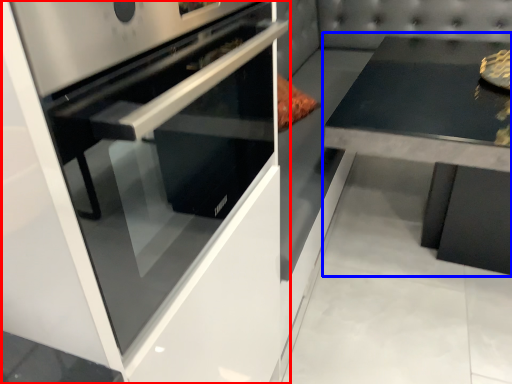
Question: Which point is closer to the camera, home appliance (highlighted by a red box) or round table (highlighted by a blue box)?

Choices:
 (A) home appliance
 (B) round table

Answer: (A)